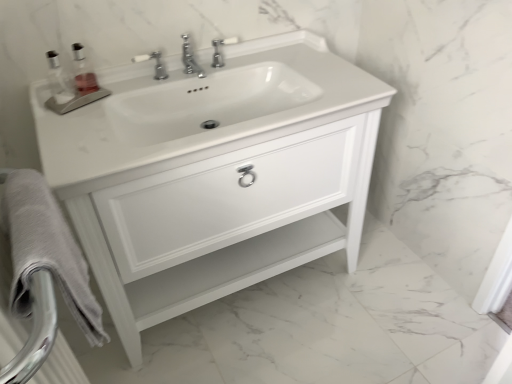
Find the location of a particular element. The height and width of the screenshot is (384, 512). free space to the back side of clear glass soap dispenser at upper left is located at coordinates (106, 81).